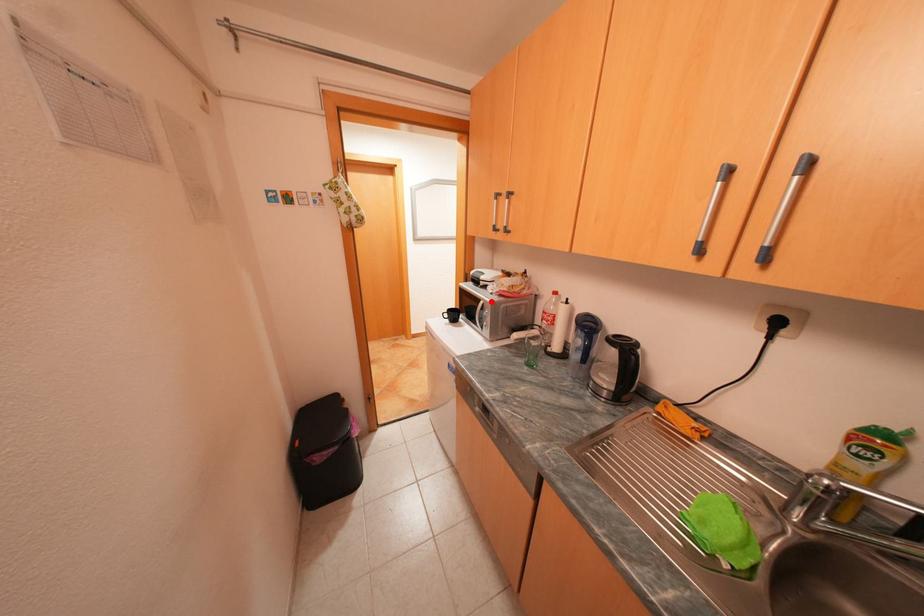
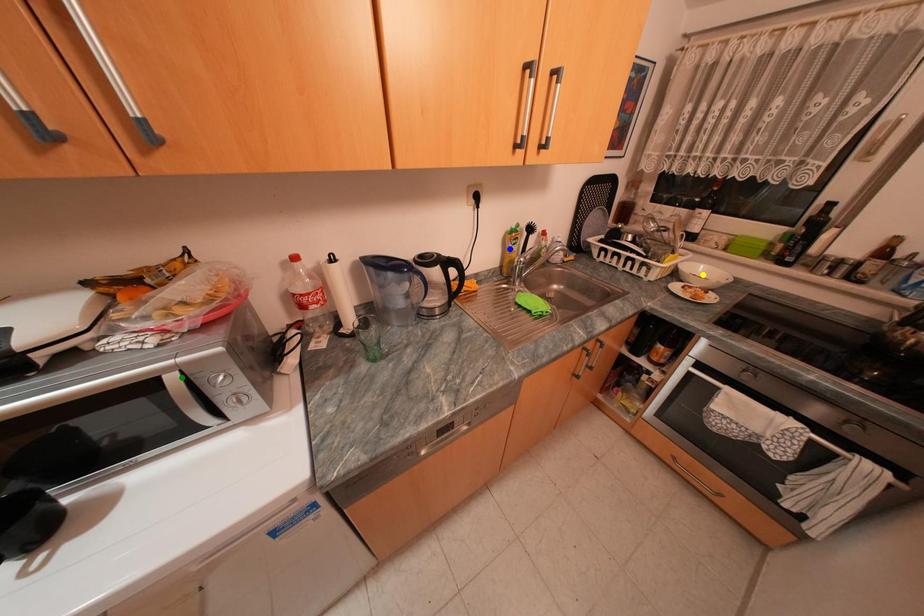
Question: I am providing you with two images of the same scene from different viewpoints. A red point is marked on the first image. You are given multiple points on the second image. Which mark in image 2 goes with the point in image 1?

Choices:
 (A) yellow point
 (B) green point
 (C) blue point

Answer: (B)